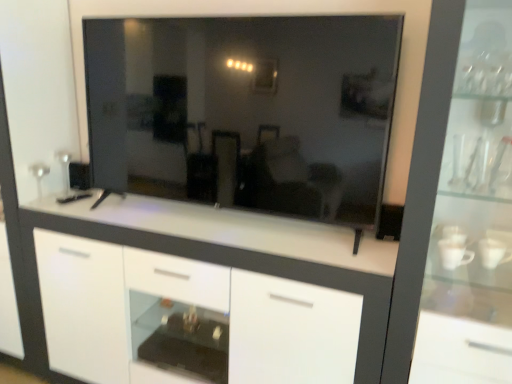
This screenshot has height=384, width=512. Identify the location of vacant region below transparent glass mirror at center (from a real-world perspective). coord(240,227).